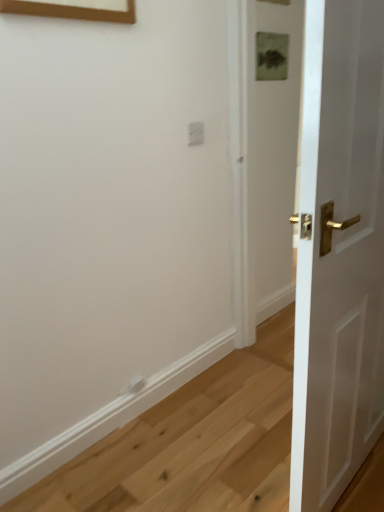
Question: From a real-world perspective, is white plastic electric outlet at upper center beneath white glossy door at right?

Choices:
 (A) no
 (B) yes

Answer: (A)

Question: Could you tell me if white plastic electric outlet at upper center is facing white glossy door at right?

Choices:
 (A) no
 (B) yes

Answer: (A)

Question: Does white plastic electric outlet at upper center have a smaller size compared to white glossy door at right?

Choices:
 (A) yes
 (B) no

Answer: (A)

Question: Is white plastic electric outlet at upper center taller than white glossy door at right?

Choices:
 (A) yes
 (B) no

Answer: (B)

Question: Is white plastic electric outlet at upper center at the right side of white glossy door at right?

Choices:
 (A) yes
 (B) no

Answer: (B)

Question: From a real-world perspective, is white plastic electric outlet at upper center on top of white glossy door at right?

Choices:
 (A) no
 (B) yes

Answer: (B)

Question: Does white glossy door at right have a lesser height compared to white plastic electric outlet at upper center?

Choices:
 (A) yes
 (B) no

Answer: (B)

Question: Can you confirm if white glossy door at right is positioned to the left of white plastic electric outlet at upper center?

Choices:
 (A) yes
 (B) no

Answer: (B)

Question: Is the position of white glossy door at right more distant than that of white plastic electric outlet at upper center?

Choices:
 (A) no
 (B) yes

Answer: (A)

Question: Is the depth of white glossy door at right less than that of white plastic electric outlet at upper center?

Choices:
 (A) yes
 (B) no

Answer: (A)

Question: Is white glossy door at right completely or partially outside of white plastic electric outlet at upper center?

Choices:
 (A) no
 (B) yes

Answer: (B)

Question: Is white glossy door at right positioned with its back to white plastic electric outlet at upper center?

Choices:
 (A) yes
 (B) no

Answer: (B)

Question: Does point (350, 150) appear closer or farther from the camera than point (200, 124)?

Choices:
 (A) farther
 (B) closer

Answer: (B)